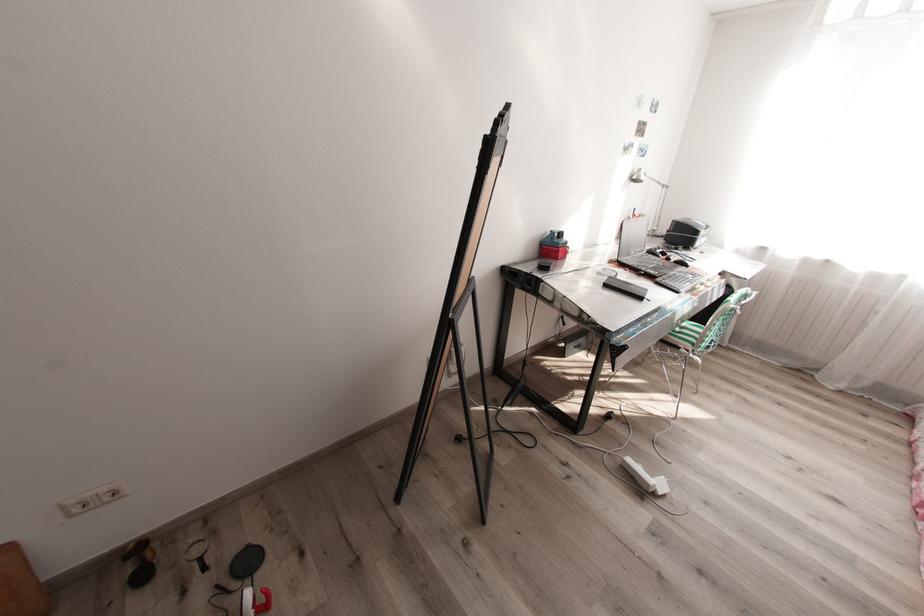
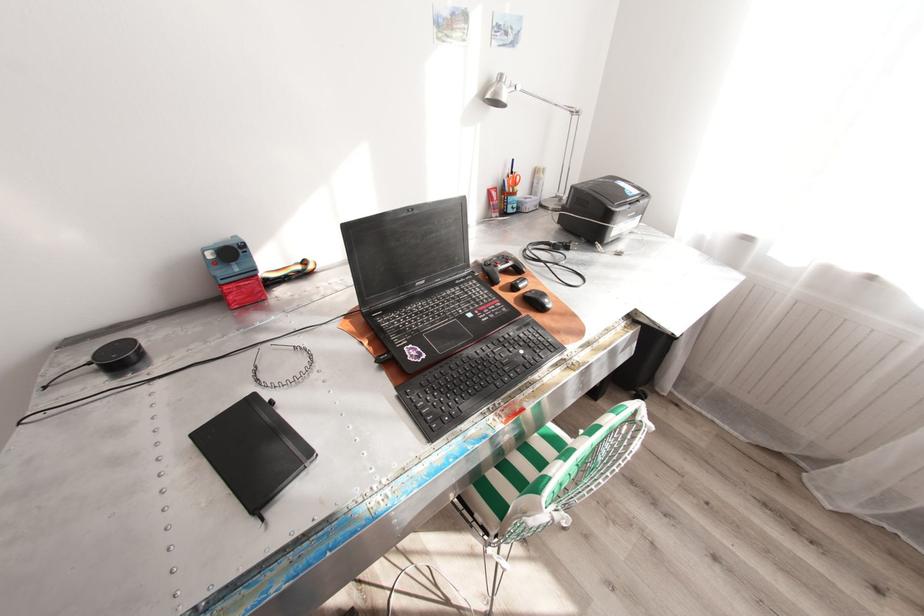
Where in the second image is the point corresponding to (x=643, y=169) from the first image?

(505, 76)